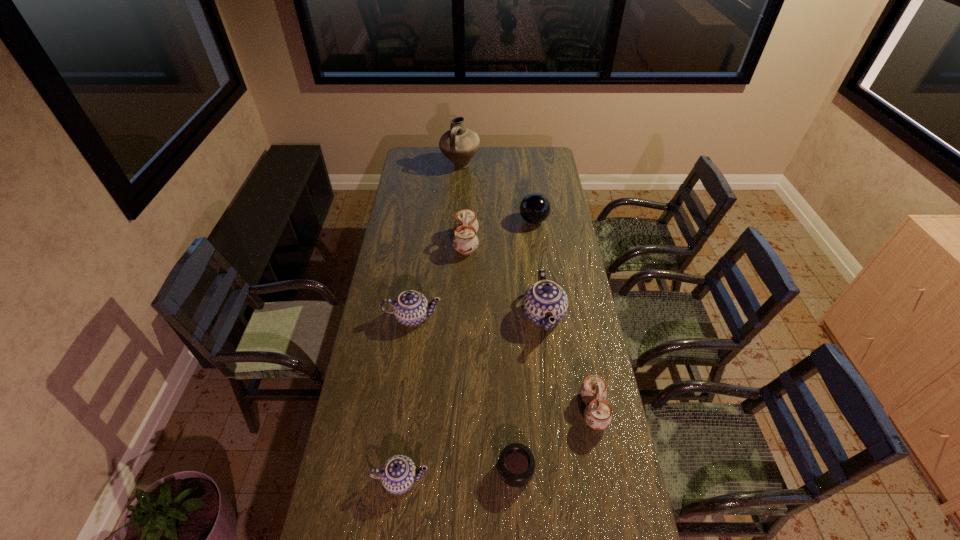
Find the location of `pitcher`. pitcher is located at coordinates (459, 144).

Locate an element on the screen. The height and width of the screenshot is (540, 960). the tallest object is located at coordinates (459, 144).

What are the coordinates of `the bigger white chinaware` in the screenshot? It's located at (465, 241).

Where is `the left white chinaware`? The height and width of the screenshot is (540, 960). the left white chinaware is located at coordinates (465, 241).

Where is `the biggest blue chinaware`? the biggest blue chinaware is located at coordinates (545, 299).

The height and width of the screenshot is (540, 960). I want to click on bowling ball, so click(535, 208).

Image resolution: width=960 pixels, height=540 pixels. I want to click on the second smallest blue chinaware, so click(x=410, y=308).

You are a GUI agent. You are given a task and a screenshot of the screen. Output one action in this format:
    pyautogui.click(x=<x>, y=<y>)
    Task: Click on the right white chinaware
    
    Given the screenshot: What is the action you would take?
    pyautogui.click(x=598, y=415)

Where is `the smaller white chinaware`? the smaller white chinaware is located at coordinates (598, 415).

Where is `the smallest blue chinaware`? The width and height of the screenshot is (960, 540). the smallest blue chinaware is located at coordinates (398, 474).